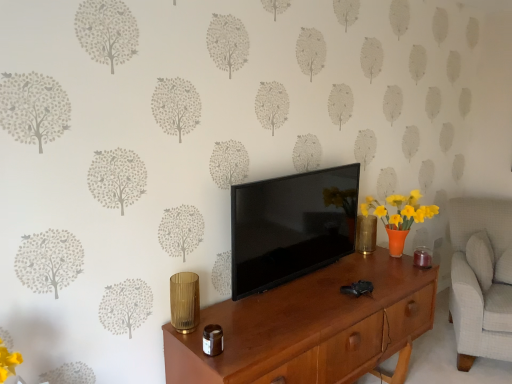
In order to face light gray fabric swivel chair at right, should I rotate leftwards or rightwards?

Rotate your view right by about 28.939°.

What is the approximate height of light gray fabric swivel chair at right?

light gray fabric swivel chair at right is 36.26 inches in height.

Find the location of a particular element. black glossy tv at center is located at coordinates (291, 226).

The height and width of the screenshot is (384, 512). Describe the element at coordinates (312, 327) in the screenshot. I see `wooden desk at center` at that location.

Where is `gold textured vase at center-right`? gold textured vase at center-right is located at coordinates (366, 234).

Identify the location of light gray fabric swivel chair at right. (480, 279).

Considering the sizes of objects black glossy tv at center and wooden desk at center in the image provided, who is smaller, black glossy tv at center or wooden desk at center?

black glossy tv at center is smaller.

Is the position of black glossy tv at center more distant than that of wooden desk at center?

Yes, black glossy tv at center is behind wooden desk at center.

Considering the sizes of black glossy tv at center and wooden desk at center in the image, is black glossy tv at center wider or thinner than wooden desk at center?

In the image, black glossy tv at center appears to be more narrow than wooden desk at center.

Who is shorter, gold textured vase at center-right or black glossy tv at center?

gold textured vase at center-right.

Is gold textured vase at center-right aimed at black glossy tv at center?

No, gold textured vase at center-right is not facing towards black glossy tv at center.

Is black glossy tv at center a part of gold textured vase at center-right?

No, gold textured vase at center-right does not contain black glossy tv at center.

Who is shorter, wooden desk at center or black glossy tv at center?

With less height is black glossy tv at center.

Is black glossy tv at center a part of wooden desk at center?

No, wooden desk at center does not contain black glossy tv at center.

Looking at the image, does wooden desk at center seem bigger or smaller compared to black glossy tv at center?

wooden desk at center is bigger than black glossy tv at center.

How different are the orientations of wooden desk at center and black glossy tv at center in degrees?

2.08 degrees.

Is light gray fabric swivel chair at right at the right side of gold textured vase at center-right?

Correct, you'll find light gray fabric swivel chair at right to the right of gold textured vase at center-right.

Is light gray fabric swivel chair at right spatially inside gold textured vase at center-right, or outside of it?

light gray fabric swivel chair at right is not inside gold textured vase at center-right, it's outside.

From the image's perspective, which one is positioned lower, light gray fabric swivel chair at right or gold textured vase at center-right?

light gray fabric swivel chair at right.

Considering the positions of point (501, 255) and point (370, 217), is point (501, 255) closer or farther from the camera than point (370, 217)?

Clearly, point (501, 255) is more distant from the camera than point (370, 217).

Considering the sizes of objects wooden desk at center and light gray fabric swivel chair at right in the image provided, who is bigger, wooden desk at center or light gray fabric swivel chair at right?

wooden desk at center is bigger.

Which of these two, wooden desk at center or light gray fabric swivel chair at right, stands taller?

With more height is light gray fabric swivel chair at right.

Is wooden desk at center positioned in front of light gray fabric swivel chair at right?

Yes, wooden desk at center is in front of light gray fabric swivel chair at right.

From a real-world perspective, is wooden desk at center under light gray fabric swivel chair at right?

Indeed, from a real-world perspective, wooden desk at center is positioned beneath light gray fabric swivel chair at right.

Measure the distance from black glossy tv at center to light gray fabric swivel chair at right.

black glossy tv at center is 1.15 meters away from light gray fabric swivel chair at right.

In terms of height, does black glossy tv at center look taller or shorter compared to light gray fabric swivel chair at right?

In the image, black glossy tv at center appears to be shorter than light gray fabric swivel chair at right.

Is black glossy tv at center positioned beyond the bounds of light gray fabric swivel chair at right?

That's correct, black glossy tv at center is outside of light gray fabric swivel chair at right.

Is black glossy tv at center bigger than light gray fabric swivel chair at right?

No.

Is wooden desk at center completely or partially outside of gold textured vase at center-right?

Yes, wooden desk at center is located beyond the bounds of gold textured vase at center-right.

In the image, is wooden desk at center positioned in front of or behind gold textured vase at center-right?

wooden desk at center is in front of gold textured vase at center-right.

Considering the relative sizes of wooden desk at center and gold textured vase at center-right in the image provided, is wooden desk at center shorter than gold textured vase at center-right?

In fact, wooden desk at center may be taller than gold textured vase at center-right.

This screenshot has height=384, width=512. Identify the location of desk lying in front of the black glossy tv at center. (312, 327).

Locate an element on the screen. vase lying on the right of black glossy tv at center is located at coordinates (366, 234).

Which object lies nearer to the anchor point black glossy tv at center, gold textured vase at center-right or light gray fabric swivel chair at right?

gold textured vase at center-right is closer to black glossy tv at center.

Looking at the image, which one is located closer to gold textured vase at center-right, wooden desk at center or black glossy tv at center?

black glossy tv at center is closer to gold textured vase at center-right.

Based on their spatial positions, is wooden desk at center or black glossy tv at center further from light gray fabric swivel chair at right?

black glossy tv at center is positioned further to the anchor light gray fabric swivel chair at right.

Estimate the real-world distances between objects in this image. Which object is closer to black glossy tv at center, gold textured vase at center-right or wooden desk at center?

Among the two, wooden desk at center is located nearer to black glossy tv at center.

Based on their spatial positions, is black glossy tv at center or light gray fabric swivel chair at right closer to gold textured vase at center-right?

Based on the image, black glossy tv at center appears to be nearer to gold textured vase at center-right.

From the image, which object appears to be farther from black glossy tv at center, light gray fabric swivel chair at right or gold textured vase at center-right?

light gray fabric swivel chair at right is positioned further to the anchor black glossy tv at center.

Looking at the image, which one is located closer to gold textured vase at center-right, light gray fabric swivel chair at right or wooden desk at center?

wooden desk at center.

Looking at the image, which one is located further to black glossy tv at center, wooden desk at center or gold textured vase at center-right?

gold textured vase at center-right is further to black glossy tv at center.

This screenshot has height=384, width=512. I want to click on vase located between wooden desk at center and light gray fabric swivel chair at right in the left-right direction, so click(366, 234).

Where is `vase between black glossy tv at center and light gray fabric swivel chair at right from left to right`? vase between black glossy tv at center and light gray fabric swivel chair at right from left to right is located at coordinates (x=366, y=234).

The image size is (512, 384). I want to click on desk between black glossy tv at center and light gray fabric swivel chair at right from left to right, so click(312, 327).

Find the location of `television located between wooden desk at center and gold textured vase at center-right in the depth direction`. television located between wooden desk at center and gold textured vase at center-right in the depth direction is located at coordinates (291, 226).